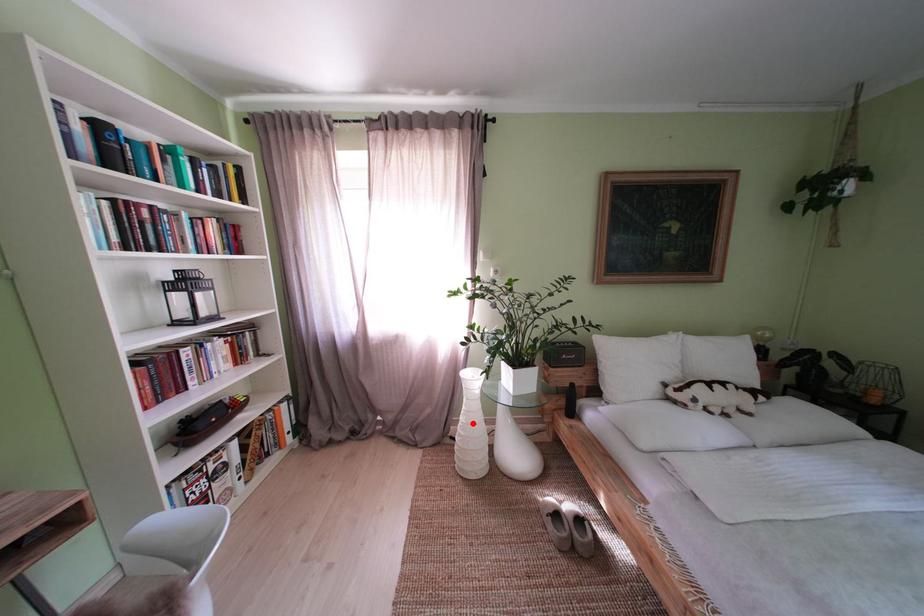
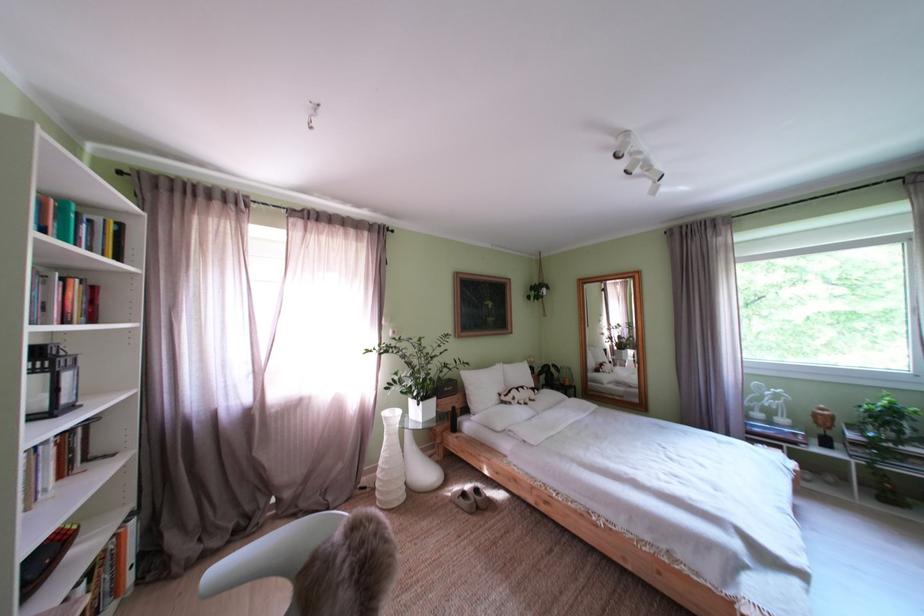
Where in the second image is the point corresponding to the highlighted location from the first image?

(395, 460)